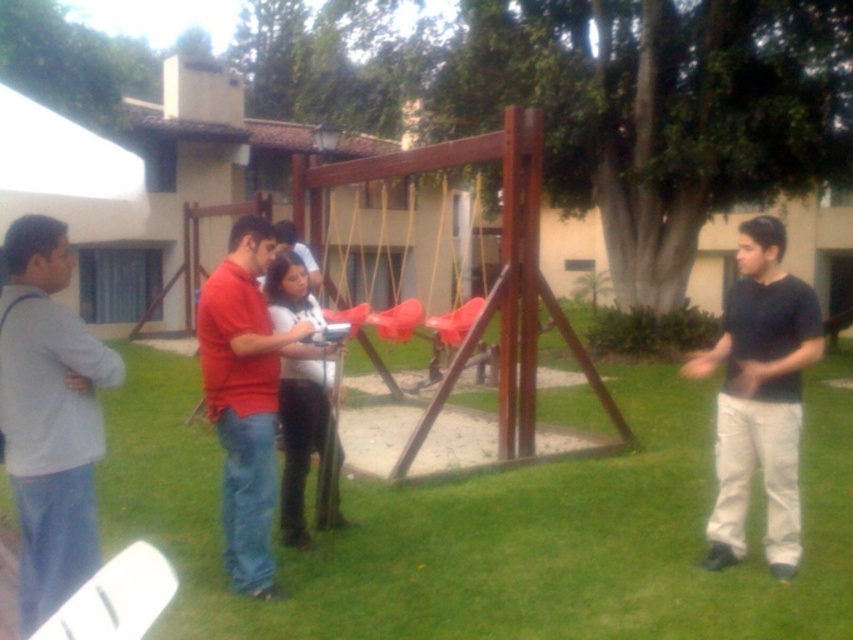
Question: Which of these objects is positioned farthest from the white matte shirt at center?

Choices:
 (A) green grass at center
 (B) light gray sweater at left
 (C) black cotton shirt at right

Answer: (C)

Question: Observing the image, what is the correct spatial positioning of light gray sweater at left in reference to white matte shirt at center?

Choices:
 (A) right
 (B) left

Answer: (B)

Question: Which object is positioned closest to the light gray sweater at left?

Choices:
 (A) white matte shirt at center
 (B) green grass at center
 (C) red matte shirt at center
 (D) black cotton shirt at right

Answer: (C)

Question: Is green grass at center smaller than white matte shirt at center?

Choices:
 (A) no
 (B) yes

Answer: (A)

Question: Which object appears closest to the camera in this image?

Choices:
 (A) green grass at center
 (B) white matte shirt at center
 (C) red matte shirt at center

Answer: (A)

Question: Is green grass at center bigger than white matte shirt at center?

Choices:
 (A) no
 (B) yes

Answer: (B)